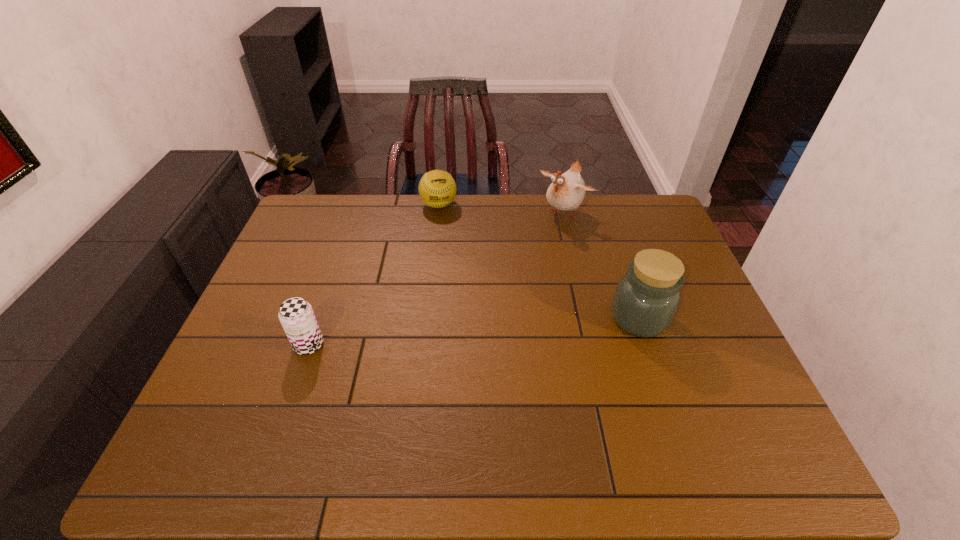
Where is `the leftmost object`? The height and width of the screenshot is (540, 960). the leftmost object is located at coordinates (296, 315).

The height and width of the screenshot is (540, 960). Identify the location of jar. (647, 297).

Locate an element on the screen. The height and width of the screenshot is (540, 960). bird is located at coordinates (566, 192).

Find the location of `softball`. softball is located at coordinates (437, 189).

In order to click on vacant space located 0.110m on the right of the leftmost object in this screenshot , I will do `click(367, 345)`.

I want to click on free space located on the back of the jar, so click(x=627, y=282).

Where is `free spot located 0.400m at the beak of the bird`? free spot located 0.400m at the beak of the bird is located at coordinates (479, 293).

You are a GUI agent. You are given a task and a screenshot of the screen. Output one action in this format:
    pyautogui.click(x=<x>, y=<y>)
    Task: Click on the vacant space situated at the beak of the bird
    The width and height of the screenshot is (960, 540).
    Given the screenshot: What is the action you would take?
    pyautogui.click(x=534, y=240)

Find the location of a particular element. free spot located at the beak of the bird is located at coordinates (535, 238).

At what (x,y) coordinates should I click in order to perform the action: click on vacant space situated on the logo side of the third object from right to left. Please return your answer as a coordinate pair (x, y). Looking at the image, I should click on (450, 248).